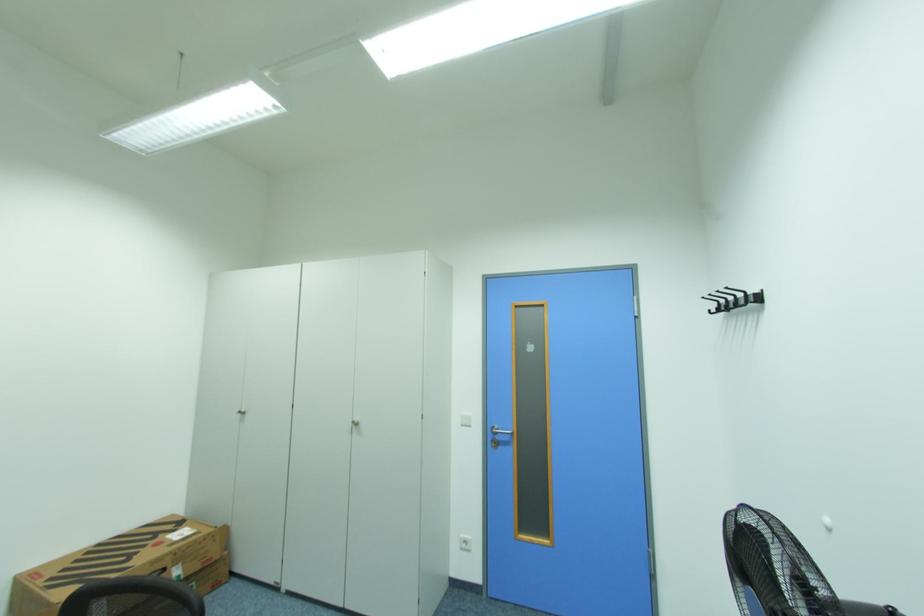
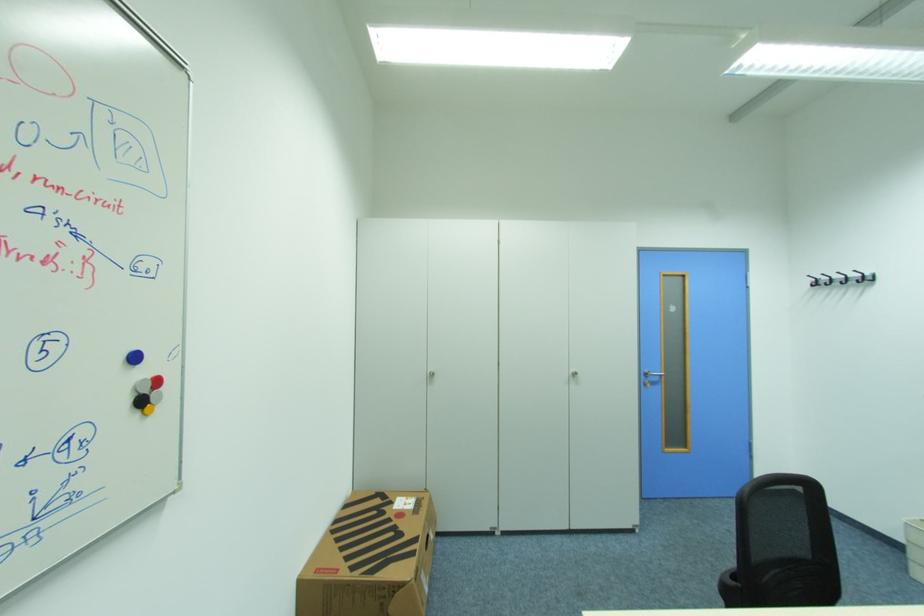
Locate, in the second image, the point that corresponds to point (178, 531) in the first image.

(396, 503)